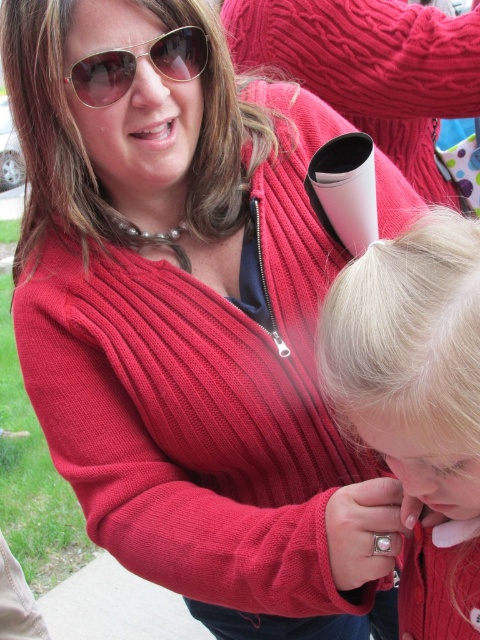
You are a photographer trying to capture a clear shot of the blonde hair at upper center and the metallic reflective sunglasses at upper left. Given that your camera has a depth of field that can focus on objects within 5 inches of each other, will both subjects be in focus?

The distance between the blonde hair at upper center and the metallic reflective sunglasses at upper left is 5.80 inches. Since the depth of field can only focus on objects within 5 inches, the two subjects are slightly out of the required range. Therefore, both may not be in focus simultaneously.

You are a photographer trying to capture both the blonde hair at center and the blonde hair at upper center in a single frame. Which of the two should you focus on first to ensure clarity in your photo?

You should focus on the blonde hair at upper center first because it is thicker than the blonde hair at center, making it easier to capture clearly.